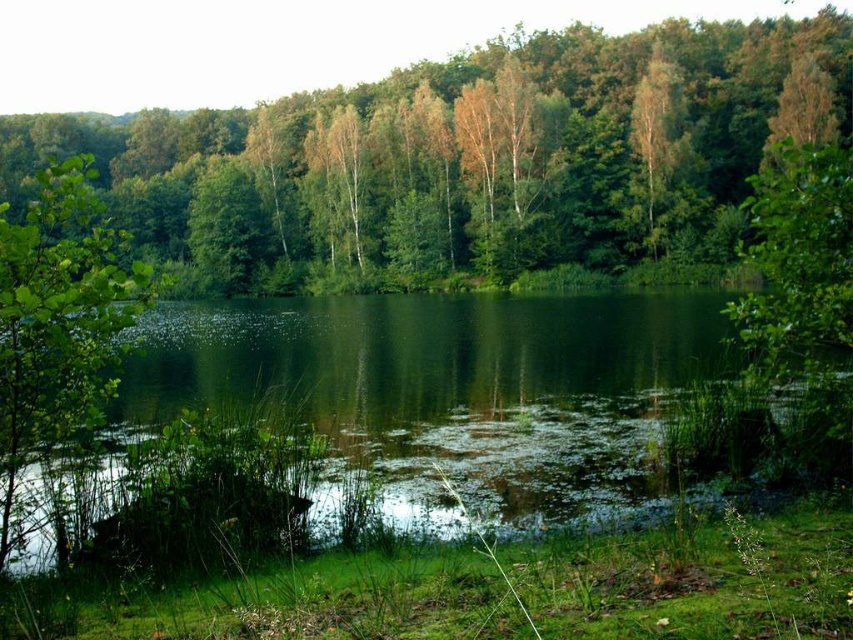
You are standing at the edge of the pond and see the green leafy tree at center and the green leafy tree at left. Which tree would cast a larger shadow on the water surface?

The green leafy tree at center is taller than the green leafy tree at left, so it would cast a larger shadow on the water surface.

You are standing at the edge of the pond and want to locate the green leafy tree at center. According to the coordinates provided, where should you look relative to your position?

The green leafy tree at center is located at coordinates point (x=463, y=160), which means it is positioned to the left and slightly above the center of the image from your perspective.

You are standing at the edge of the pond and see both the green leafy tree at center and the green liquid at center. Which object is closer to you?

The green leafy tree at center is closer to you because it is positioned in front of the green liquid at center.